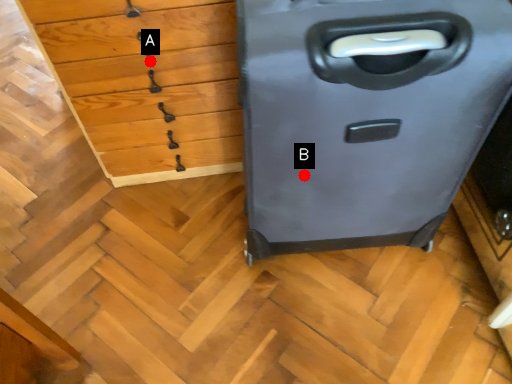
Question: Two points are circled on the image, labeled by A and B beside each circle. Which point appears farthest from the camera in this image?

Choices:
 (A) A is further
 (B) B is further

Answer: (A)